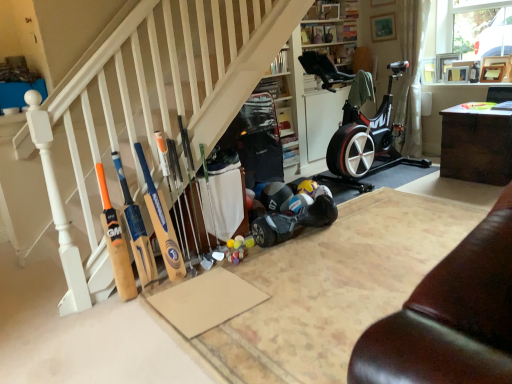
Locate an element on the screen. The width and height of the screenshot is (512, 384). free point in front of wooden baseball bat at center, arranged as the first baseball bat when viewed from the right is located at coordinates (177, 281).